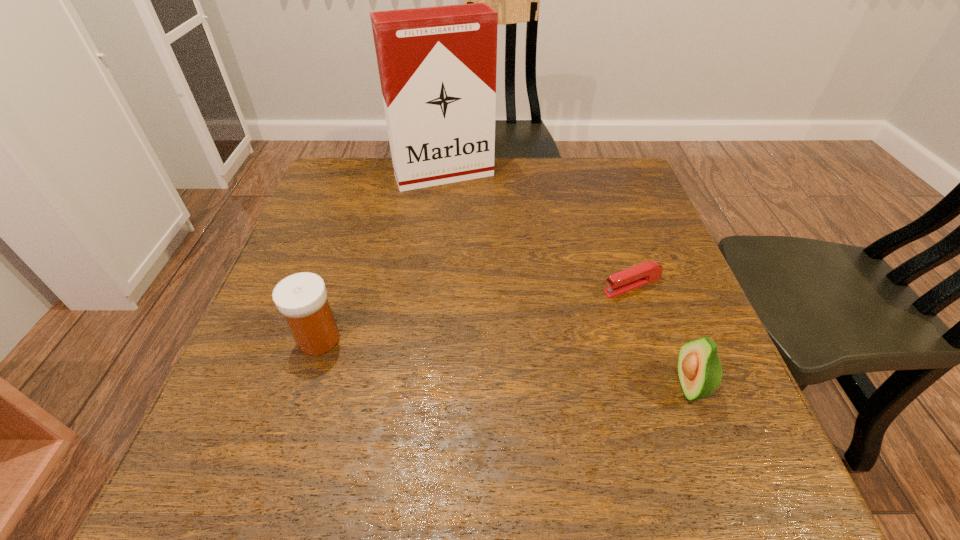
The image size is (960, 540). I want to click on free space on the desktop that is between the third farthest object and the avocado and is positioned on the front-facing side of the tallest object, so click(x=535, y=366).

You are a GUI agent. You are given a task and a screenshot of the screen. Output one action in this format:
    pyautogui.click(x=<x>, y=<y>)
    Task: Click on the free space on the desktop that is between the medicine and the nearest object and is positioned on the front-facing side of the stapler
    The image size is (960, 540).
    Given the screenshot: What is the action you would take?
    pyautogui.click(x=448, y=355)